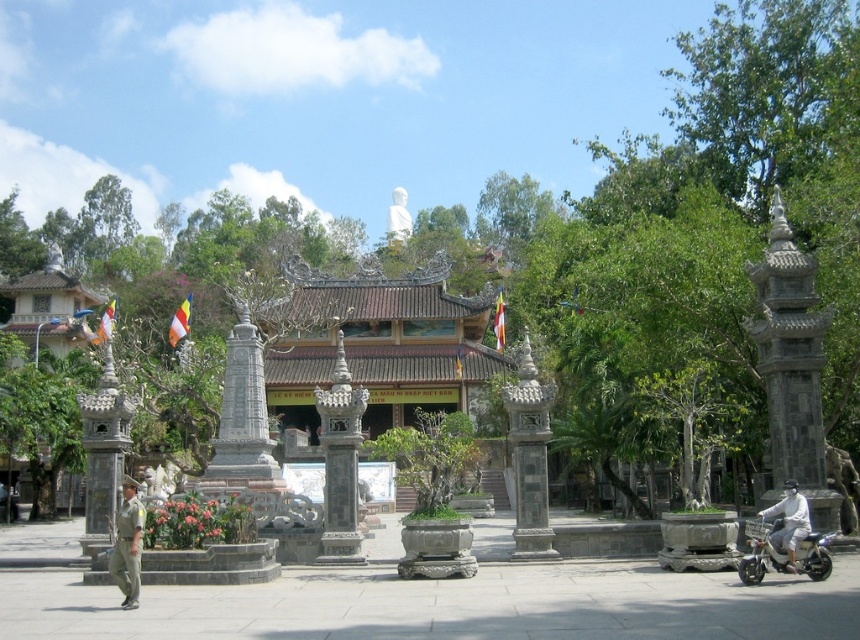
You are standing at the entrance of the temple complex and need to reach the security guard wearing the khaki uniform at lower left. The metallic silver scooter at lower right is blocking your path. Can you walk around it without crossing the flowerbeds?

The metallic silver scooter at lower right is 30.16 meters away from the khaki uniform at lower left. Since the scooter is far away, you can easily walk around it without needing to cross the flowerbeds.

You are a visitor at the temple complex and want to park your scooter near the entrance. The temple has a rule that vehicles must be parked behind the flowerbeds. Given the khaki uniform at lower left and the white matte scooter at lower right, which object is closer to the flowerbeds?

The khaki uniform at lower left is located below the white matte scooter at lower right, meaning the khaki uniform at lower left is closer to the flowerbeds.